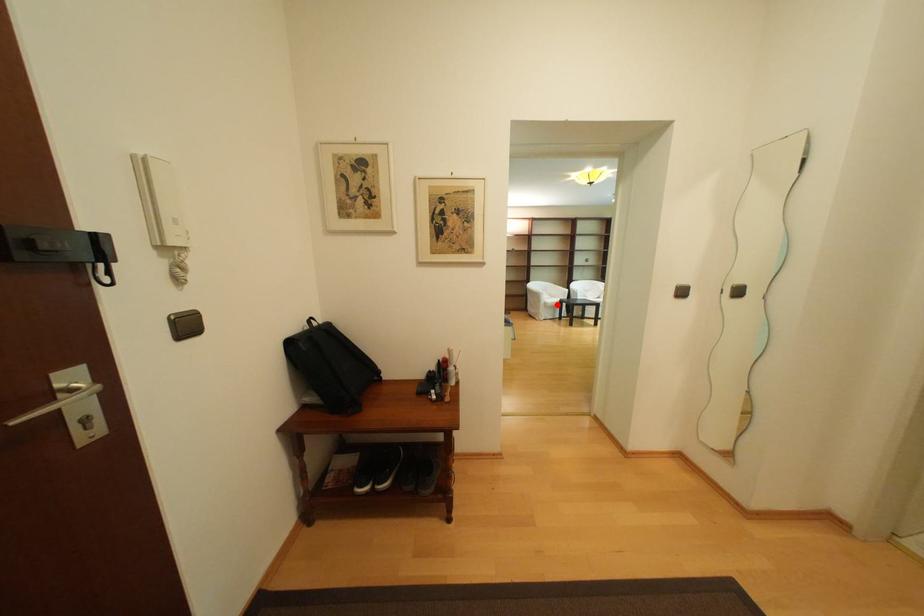
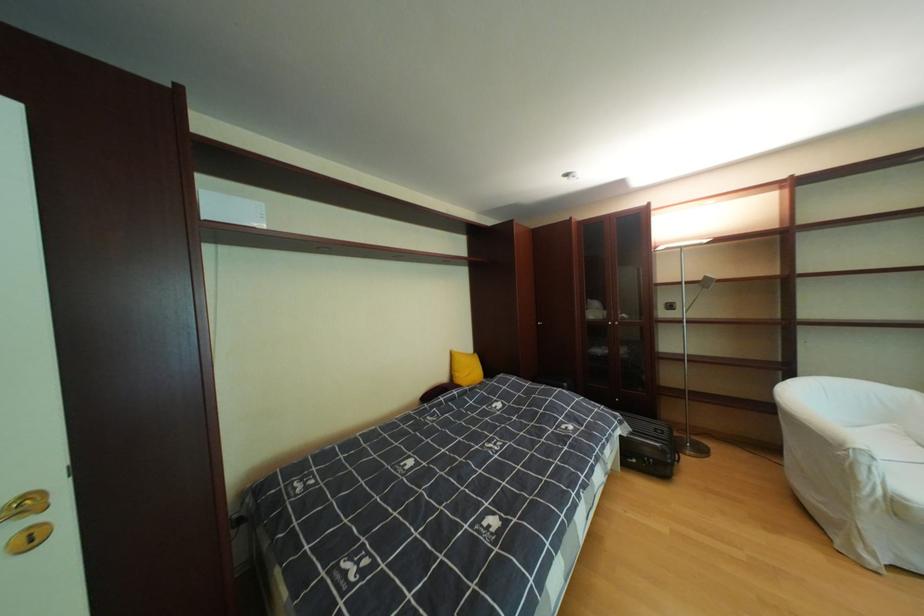
Question: I am providing you with two images of the same scene from different viewpoints. A red point is marked on the first image. Is the red point's position out of view in image 2?

Choices:
 (A) Yes
 (B) No

Answer: (B)